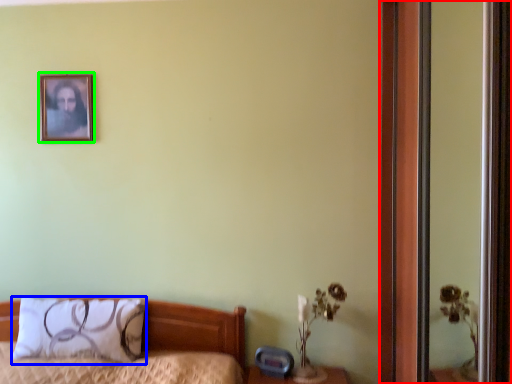
Question: Which object is the farthest from screen door (highlighted by a red box)? Choose among these: pillow (highlighted by a blue box) or picture frame (highlighted by a green box).

Choices:
 (A) pillow
 (B) picture frame

Answer: (B)